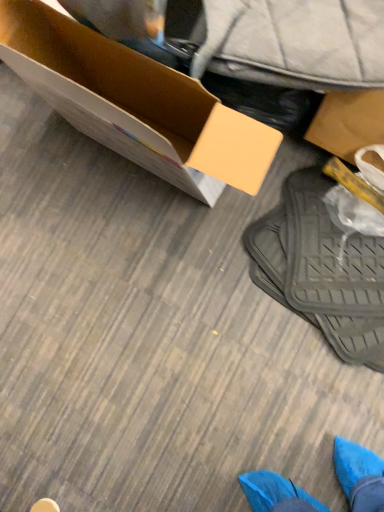
Question: Is black rubber mat at lower right in front of or behind cardboard box at upper left in the image?

Choices:
 (A) behind
 (B) front

Answer: (A)

Question: Is point (349, 276) positioned closer to the camera than point (180, 128)?

Choices:
 (A) closer
 (B) farther

Answer: (A)

Question: Estimate the real-world distances between objects in this image. Which object is farther from the cardboard box at upper left?

Choices:
 (A) black rubber mat at lower right
 (B) blue suede shoe at lower left

Answer: (B)

Question: Based on their relative distances, which object is farther from the black rubber mat at lower right?

Choices:
 (A) cardboard box at upper left
 (B) blue suede shoe at lower left

Answer: (B)